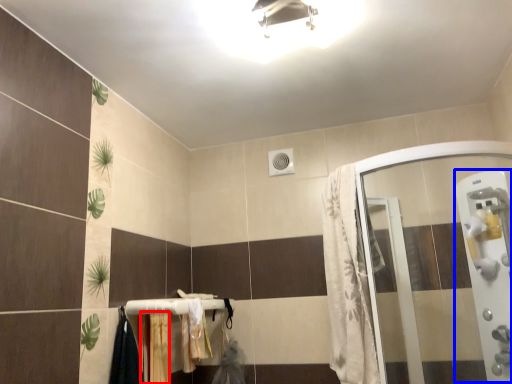
Question: Which object is closer to the camera taking this photo, curtain (highlighted by a red box) or screen door (highlighted by a blue box)?

Choices:
 (A) curtain
 (B) screen door

Answer: (B)